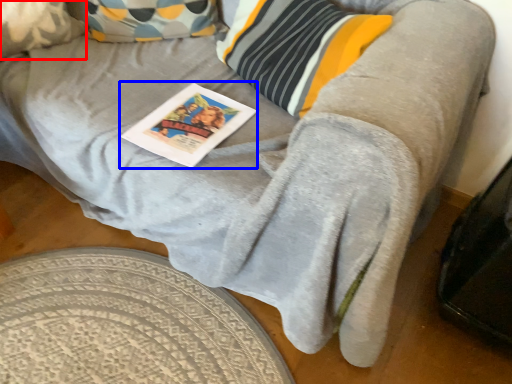
Question: Among these objects, which one is nearest to the camera, pillow (highlighted by a red box) or magazine (highlighted by a blue box)?

Choices:
 (A) pillow
 (B) magazine

Answer: (B)